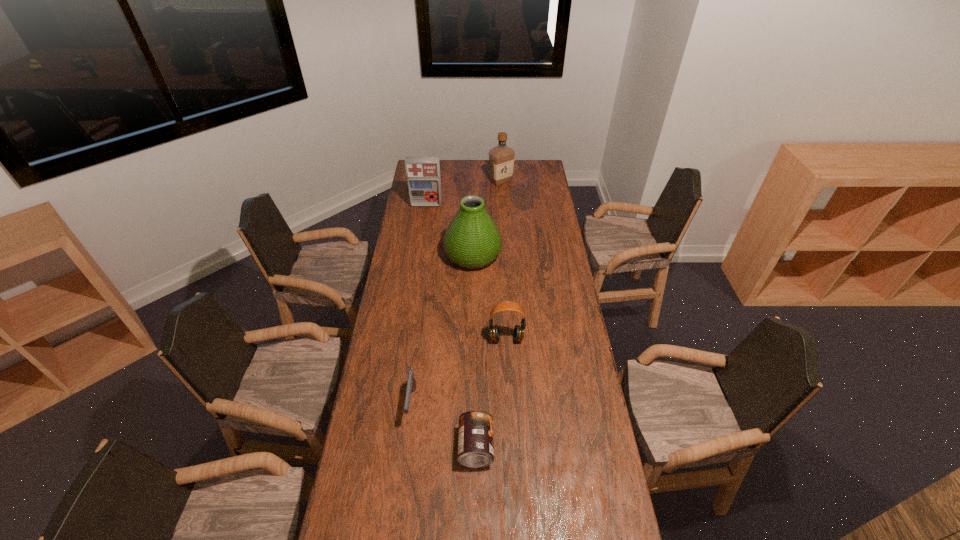
I want to click on free space located 0.380m on the ear cups of the headset, so click(x=512, y=438).

Where is `free space located 0.110m at the barrel of the second nearest object`? The image size is (960, 540). free space located 0.110m at the barrel of the second nearest object is located at coordinates (405, 458).

This screenshot has height=540, width=960. I want to click on vacant area situated 0.210m on the front label of the can, so click(558, 447).

Find the location of a particular element. object that is positioned at the far edge is located at coordinates (501, 157).

The image size is (960, 540). In order to click on the first-aid kit at the left edge in this screenshot , I will do `click(423, 173)`.

The width and height of the screenshot is (960, 540). Identify the location of pistol positioned at the left edge. (411, 382).

The width and height of the screenshot is (960, 540). In the image, there is a desktop. In order to click on vacant area at the far edge in this screenshot , I will do `click(516, 174)`.

At what (x,y) coordinates should I click in order to perform the action: click on vacant space at the left edge of the desktop. Please return your answer as a coordinate pair (x, y). The image size is (960, 540). Looking at the image, I should click on (434, 209).

In order to click on vacant point at the right edge in this screenshot , I will do `click(542, 281)`.

You are a GUI agent. You are given a task and a screenshot of the screen. Output one action in this format:
    pyautogui.click(x=<x>, y=<y>)
    Task: Click on the vacant space in between the liquor and the nearest object
    Image resolution: width=960 pixels, height=540 pixels.
    Given the screenshot: What is the action you would take?
    pyautogui.click(x=489, y=314)